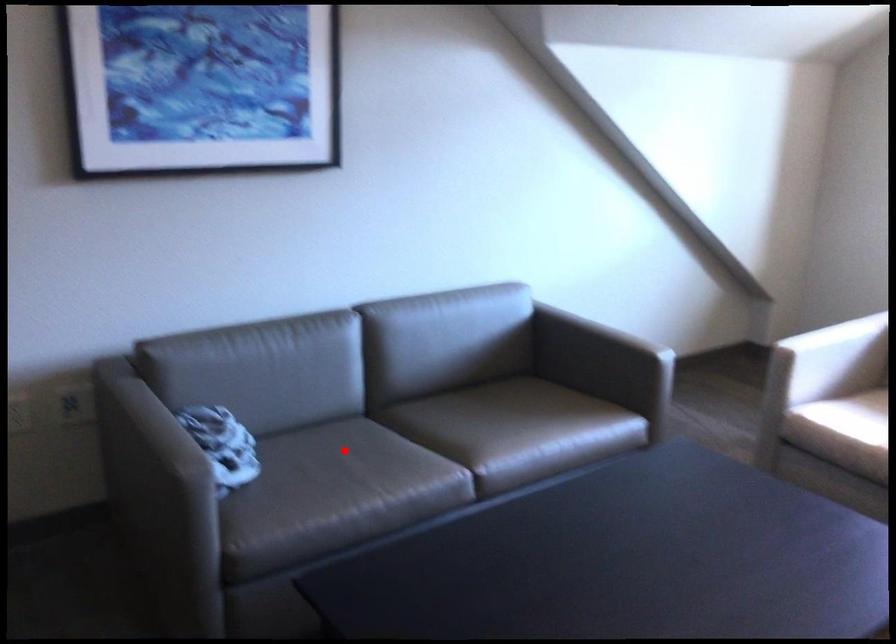
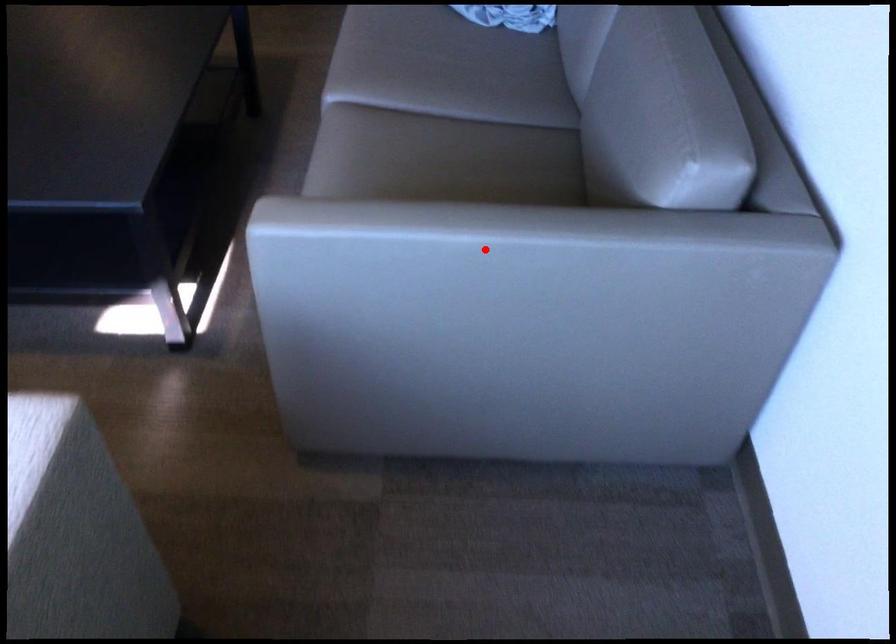
I am providing you with two images of the same scene from different viewpoints. A red point is marked on the first image and another point is marked on the second image. Are the points marked in image1 and image2 representing the same 3D position?

No